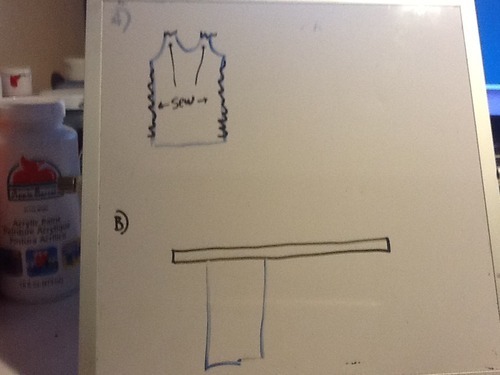
Identify the location of gray coffee mug. Image resolution: width=500 pixels, height=375 pixels. (21, 87).